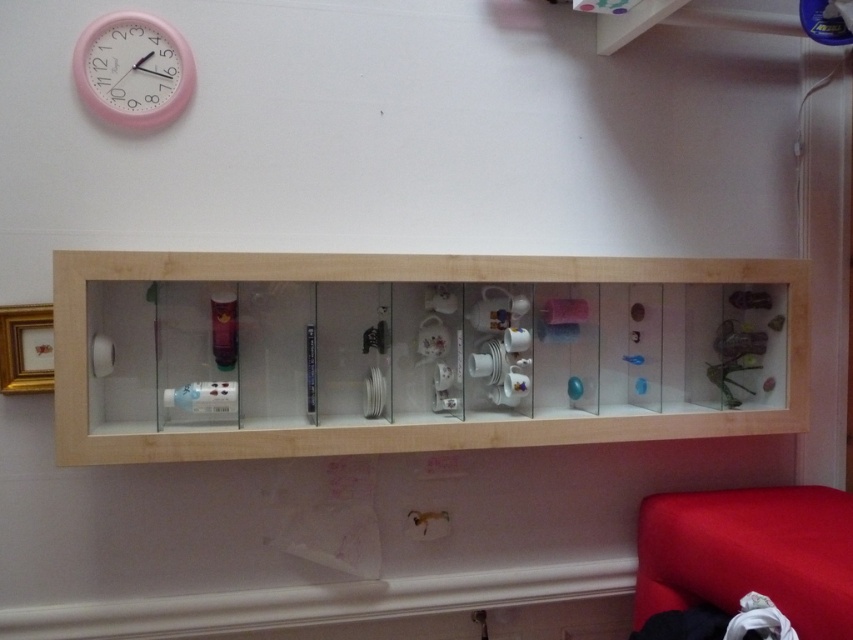
Question: Which object is farther from the camera taking this photo?

Choices:
 (A) pink plastic clock at upper left
 (B) light wood/transparent glass medicine cabinet at center

Answer: (A)

Question: Is light wood/transparent glass medicine cabinet at center to the right of pink plastic clock at upper left from the viewer's perspective?

Choices:
 (A) yes
 (B) no

Answer: (A)

Question: Does light wood/transparent glass medicine cabinet at center appear under pink plastic clock at upper left?

Choices:
 (A) yes
 (B) no

Answer: (A)

Question: Among these objects, which one is farthest from the camera?

Choices:
 (A) pink plastic clock at upper left
 (B) light wood/transparent glass medicine cabinet at center

Answer: (A)

Question: Observing the image, what is the correct spatial positioning of light wood/transparent glass medicine cabinet at center in reference to pink plastic clock at upper left?

Choices:
 (A) left
 (B) right

Answer: (B)